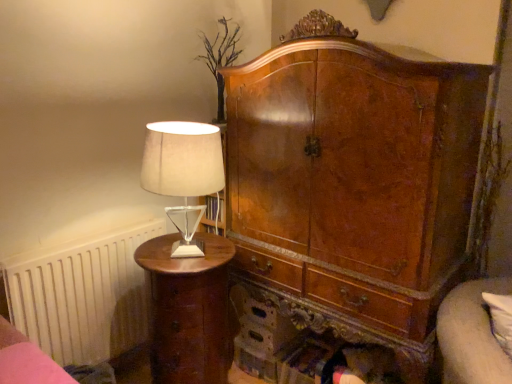
Question: Is matte brown nightstand at left turned away from wooden bed frame at lower left?

Choices:
 (A) no
 (B) yes

Answer: (A)

Question: Is matte brown nightstand at left not near wooden bed frame at lower left?

Choices:
 (A) no
 (B) yes

Answer: (A)

Question: Is matte brown nightstand at left to the left of wooden bed frame at lower left from the viewer's perspective?

Choices:
 (A) yes
 (B) no

Answer: (B)

Question: From a real-world perspective, is matte brown nightstand at left over wooden bed frame at lower left?

Choices:
 (A) yes
 (B) no

Answer: (B)

Question: Is matte brown nightstand at left behind wooden bed frame at lower left?

Choices:
 (A) no
 (B) yes

Answer: (B)

Question: Is wooden bed frame at lower left a part of matte brown nightstand at left?

Choices:
 (A) yes
 (B) no

Answer: (B)

Question: Can you confirm if satin beige lampshade at left is thinner than matte brown nightstand at left?

Choices:
 (A) yes
 (B) no

Answer: (A)

Question: From a real-world perspective, is satin beige lampshade at left beneath matte brown nightstand at left?

Choices:
 (A) yes
 (B) no

Answer: (B)

Question: Could you tell me if satin beige lampshade at left is turned towards matte brown nightstand at left?

Choices:
 (A) yes
 (B) no

Answer: (B)

Question: Considering the relative positions of satin beige lampshade at left and matte brown nightstand at left in the image provided, is satin beige lampshade at left to the right of matte brown nightstand at left from the viewer's perspective?

Choices:
 (A) yes
 (B) no

Answer: (A)

Question: From the image's perspective, is satin beige lampshade at left located beneath matte brown nightstand at left?

Choices:
 (A) no
 (B) yes

Answer: (A)

Question: Considering the relative positions of satin beige lampshade at left and matte brown nightstand at left in the image provided, is satin beige lampshade at left to the left of matte brown nightstand at left from the viewer's perspective?

Choices:
 (A) yes
 (B) no

Answer: (B)

Question: Considering the relative sizes of wooden bed frame at lower left and satin beige lampshade at left in the image provided, is wooden bed frame at lower left wider than satin beige lampshade at left?

Choices:
 (A) no
 (B) yes

Answer: (B)